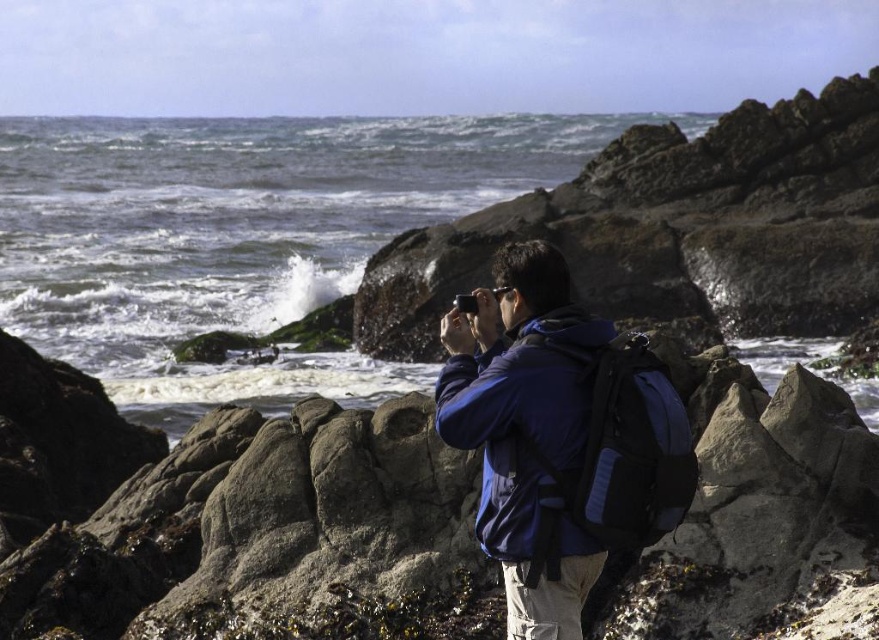
Question: Which point is closer to the camera taking this photo?

Choices:
 (A) (212, 141)
 (B) (787, 572)

Answer: (B)

Question: Can you confirm if rough stone rocks at center is smaller than clear water at center?

Choices:
 (A) yes
 (B) no

Answer: (A)

Question: Does clear water at center appear on the right side of blue fabric backpack at center?

Choices:
 (A) no
 (B) yes

Answer: (A)

Question: Among these objects, which one is nearest to the camera?

Choices:
 (A) blue fabric backpack at center
 (B) clear water at center
 (C) rough stone rocks at center

Answer: (A)

Question: Which of the following is the farthest from the observer?

Choices:
 (A) (35, 374)
 (B) (456, 320)

Answer: (A)

Question: Does rough stone rocks at center lie in front of blue fabric backpack at center?

Choices:
 (A) no
 (B) yes

Answer: (A)